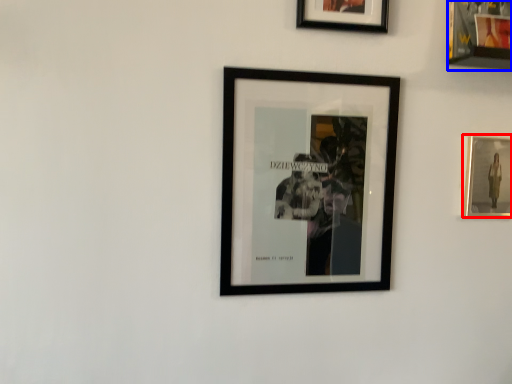
Question: Which of the following is the farthest to the observer, picture frame (highlighted by a red box) or picture frame (highlighted by a blue box)?

Choices:
 (A) picture frame
 (B) picture frame

Answer: (A)